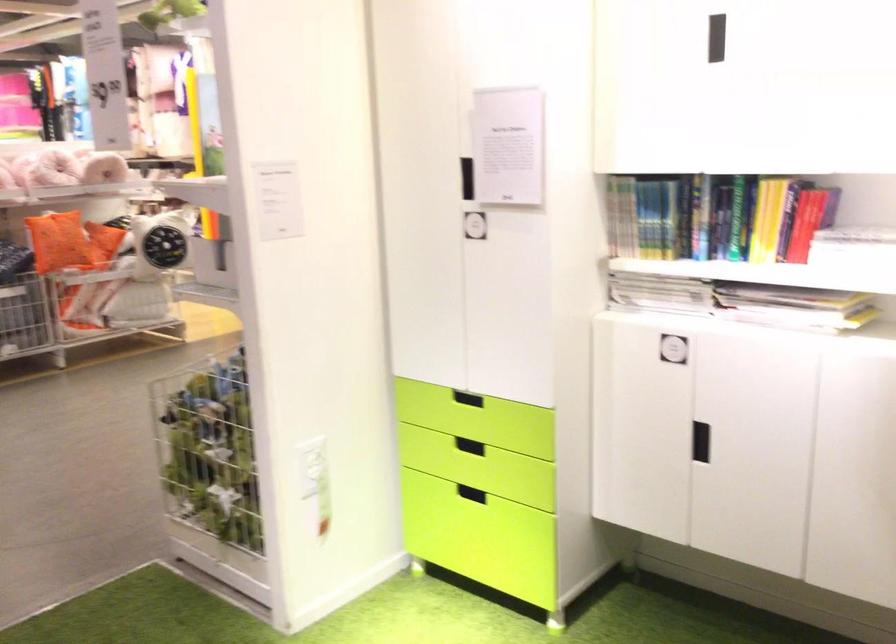
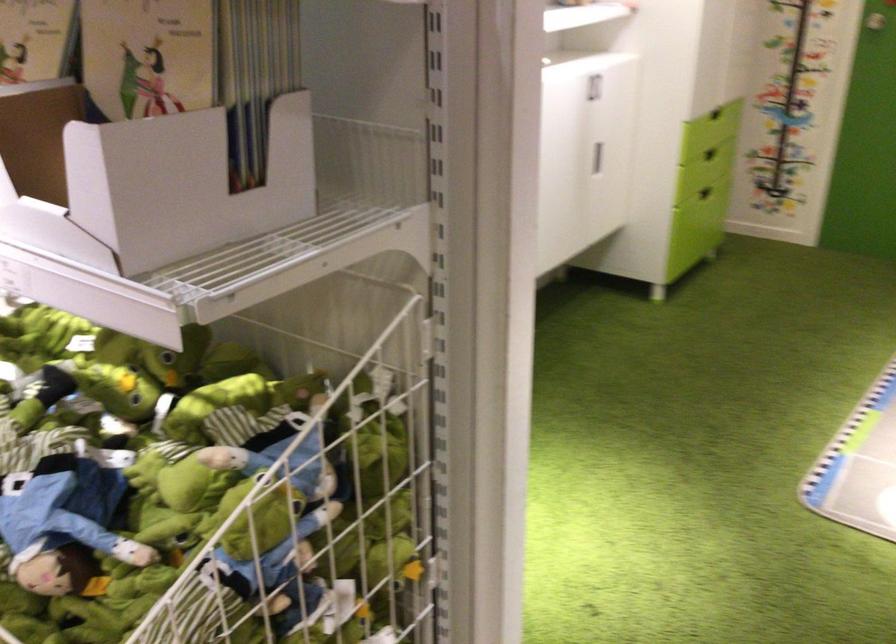
Where in the second image is the point corresponding to [212,379] from the first image?

(254, 516)